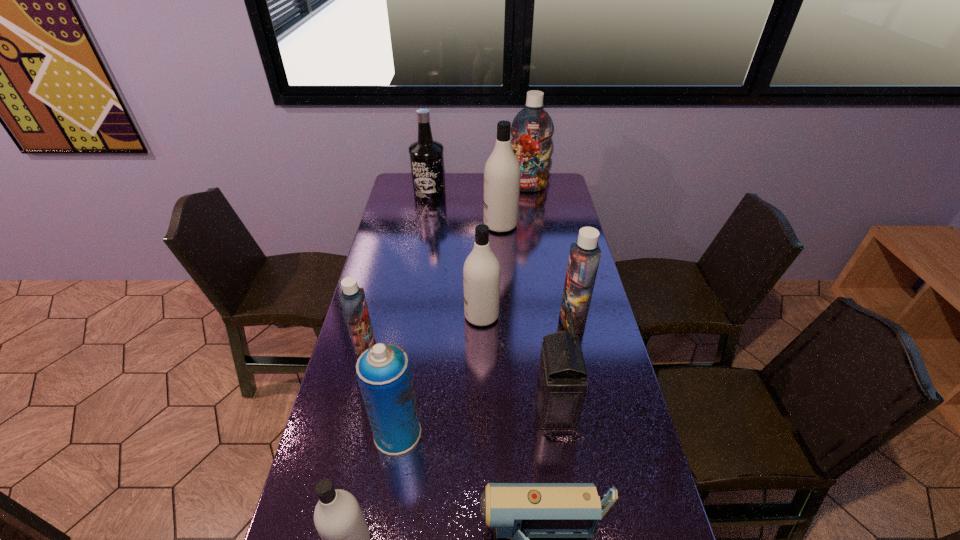
I want to click on the second farthest shampoo, so click(x=502, y=172).

I want to click on the farthest white shampoo, so pos(502,172).

Locate an element on the screen. Image resolution: width=960 pixels, height=540 pixels. the farthest shampoo is located at coordinates (532, 128).

Locate an element on the screen. The height and width of the screenshot is (540, 960). the farthest blue shampoo is located at coordinates (532, 128).

In order to click on liquor in this screenshot , I will do point(426,155).

What are the coordinates of `the second smallest blue shampoo` in the screenshot? It's located at (584, 257).

Locate an element on the screen. the second nearest white shampoo is located at coordinates [x=481, y=272].

Locate an element on the screen. The image size is (960, 540). gray lantern is located at coordinates pos(560,387).

Find the location of `aerosol can`. aerosol can is located at coordinates (383, 371).

Identify the location of the leftmost blue shampoo. The width and height of the screenshot is (960, 540). coord(353,301).